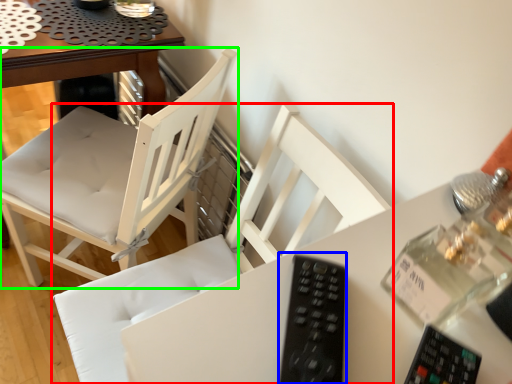
Question: Considering the real-world distances, which object is farthest from chair (highlighted by a red box)? remote (highlighted by a blue box) or chair (highlighted by a green box)?

Choices:
 (A) remote
 (B) chair

Answer: (A)